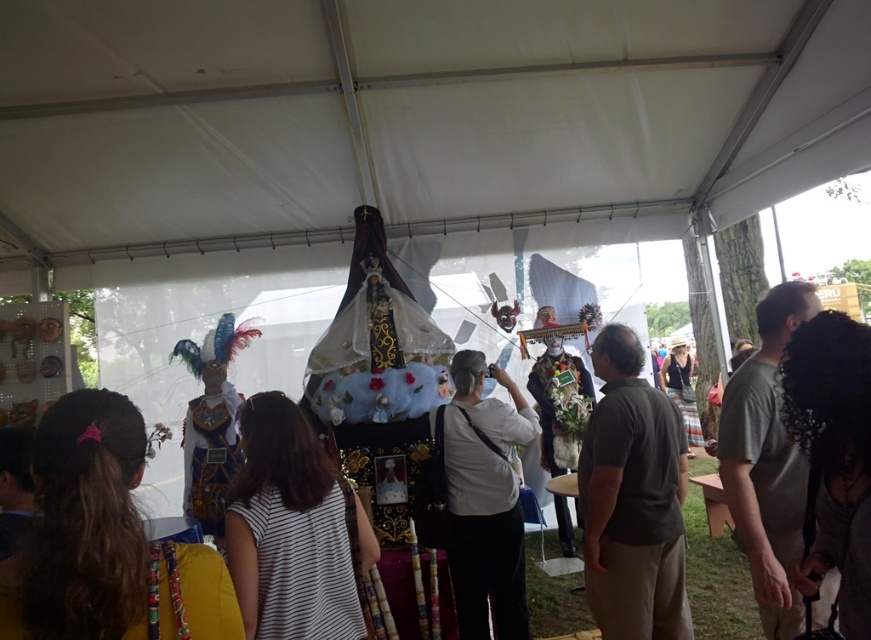
Is white fabric canopy at upper center thinner than dark green shirt at center?

In fact, white fabric canopy at upper center might be wider than dark green shirt at center.

Does white fabric canopy at upper center have a smaller size compared to dark green shirt at center?

Incorrect, white fabric canopy at upper center is not smaller in size than dark green shirt at center.

Where is `white fabric canopy at upper center`? white fabric canopy at upper center is located at coordinates (409, 122).

Does white fabric canopy at upper center have a smaller size compared to white matte shirt at center?

No, white fabric canopy at upper center is not smaller than white matte shirt at center.

Between point (443, 76) and point (487, 506), which one is positioned behind?

The point (443, 76) is behind.

Locate an element on the screen. white fabric canopy at upper center is located at coordinates (409, 122).

From the picture: Who is higher up, gray cotton shirt at right or white fabric mask at center?

gray cotton shirt at right is higher up.

Is point (755, 396) farther from viewer compared to point (717, 605)?

No.

This screenshot has height=640, width=871. Identify the location of gray cotton shirt at right. (766, 460).

Image resolution: width=871 pixels, height=640 pixels. In order to click on gray cotton shirt at right in this screenshot , I will do `click(766, 460)`.